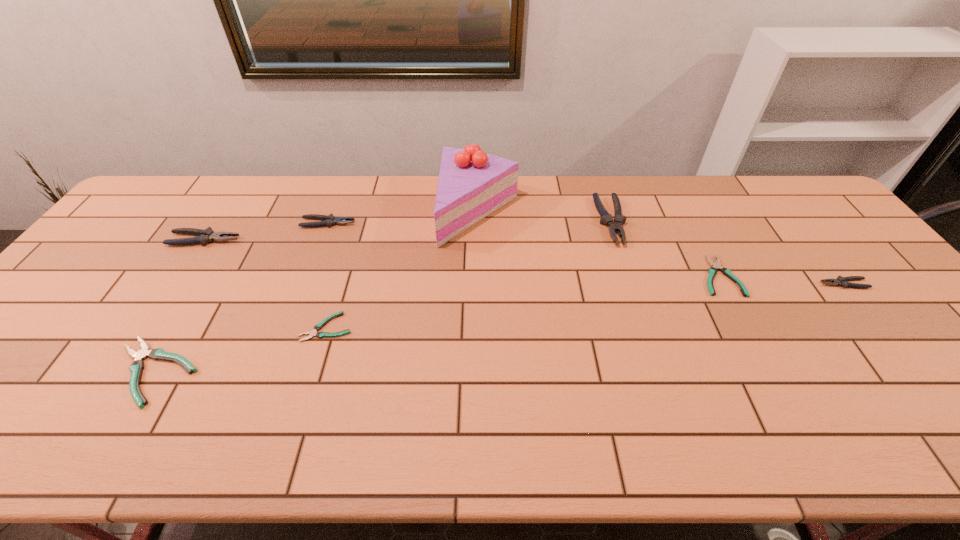
You are a GUI agent. You are given a task and a screenshot of the screen. Output one action in this format:
    pyautogui.click(x=<x>, y=<y>)
    Task: Click on the free space between the seventh shortest object and the tallest object
    
    Given the screenshot: What is the action you would take?
    pyautogui.click(x=545, y=216)

Identify which object is the seventh closest to the rightmost object. Please provide its 2D coordinates. Your answer should be formatted as a tuple, i.e. [(x, y)], where the tuple contains the x and y coordinates of a point satisfying the conditions above.

[(205, 236)]

Where is `object that stands as the closest to the shortest object`? This screenshot has width=960, height=540. object that stands as the closest to the shortest object is located at coordinates (137, 366).

Identify the location of pliers that is the sixth closest one to the biggest teal pliers. (842, 281).

Identify which pliers is the fourth nearest to the third tallest object. Please provide its 2D coordinates. Your answer should be formatted as a tuple, i.e. [(x, y)], where the tuple contains the x and y coordinates of a point satisfying the conditions above.

[(606, 218)]

Locate an element on the screen. gray pliers that stands as the third closest to the rightmost object is located at coordinates (205, 236).

The height and width of the screenshot is (540, 960). What are the coordinates of `gray pliers that is the closest to the cake` in the screenshot? It's located at (606, 218).

Locate which teal pliers is the closest to the shortest object. Please provide its 2D coordinates. Your answer should be formatted as a tuple, i.e. [(x, y)], where the tuple contains the x and y coordinates of a point satisfying the conditions above.

[(137, 366)]

Locate an element on the screen. The width and height of the screenshot is (960, 540). teal pliers that stands as the closest to the cake is located at coordinates (318, 326).

Where is `vacant area in the image that satisfies the following two spatial constraints: 1. at the gripping part of the third gray pliers from right to left; 2. on the right side of the shortest pliers`? The image size is (960, 540). vacant area in the image that satisfies the following two spatial constraints: 1. at the gripping part of the third gray pliers from right to left; 2. on the right side of the shortest pliers is located at coordinates (289, 327).